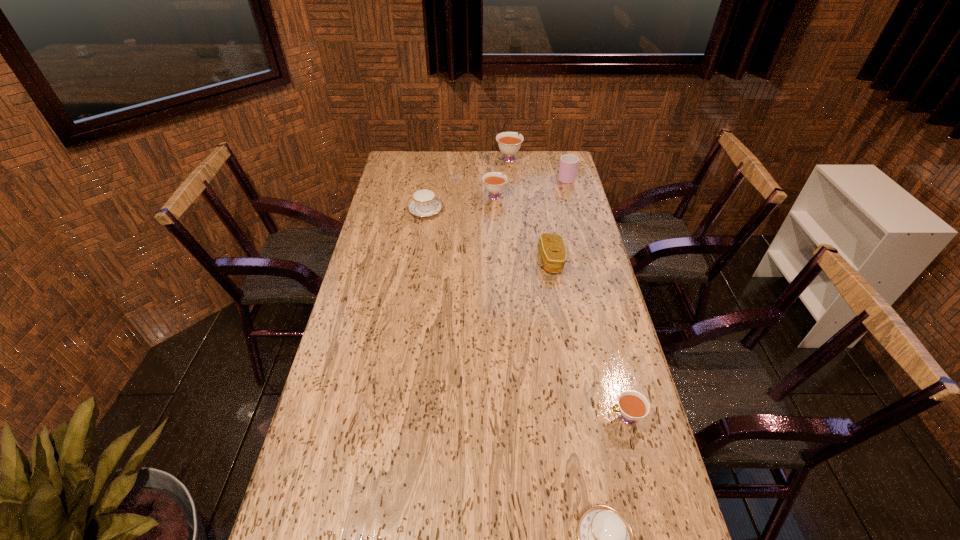
I want to click on free point between the fourth farthest teacup and the clutch bag, so click(588, 339).

Locate an element on the screen. The image size is (960, 540). vacant area that lies between the third nearest object and the cup is located at coordinates (559, 219).

At what (x,y) coordinates should I click in order to perform the action: click on the sixth closest object relative to the second farthest white teacup. Please return your answer as a coordinate pair (x, y). Looking at the image, I should click on (606, 539).

The width and height of the screenshot is (960, 540). Find the location of `object identified as the fifth closest to the leftmost object`. object identified as the fifth closest to the leftmost object is located at coordinates (633, 406).

I want to click on the third closest teacup relative to the nearest white teacup, so click(x=494, y=182).

At what (x,y) coordinates should I click in order to perform the action: click on the fourth closest teacup to the tallest teacup. Please return your answer as a coordinate pair (x, y). This screenshot has height=540, width=960. Looking at the image, I should click on (606, 539).

This screenshot has width=960, height=540. I want to click on white teacup that can be found as the closest to the third nearest object, so click(x=494, y=182).

Image resolution: width=960 pixels, height=540 pixels. What are the coordinates of `white teacup that is the closest to the cup` in the screenshot? It's located at (509, 143).

Choose which blue teacup is the second nearest neighbor to the farthest teacup. Please provide its 2D coordinates. Your answer should be formatted as a tuple, i.e. [(x, y)], where the tuple contains the x and y coordinates of a point satisfying the conditions above.

[(606, 539)]